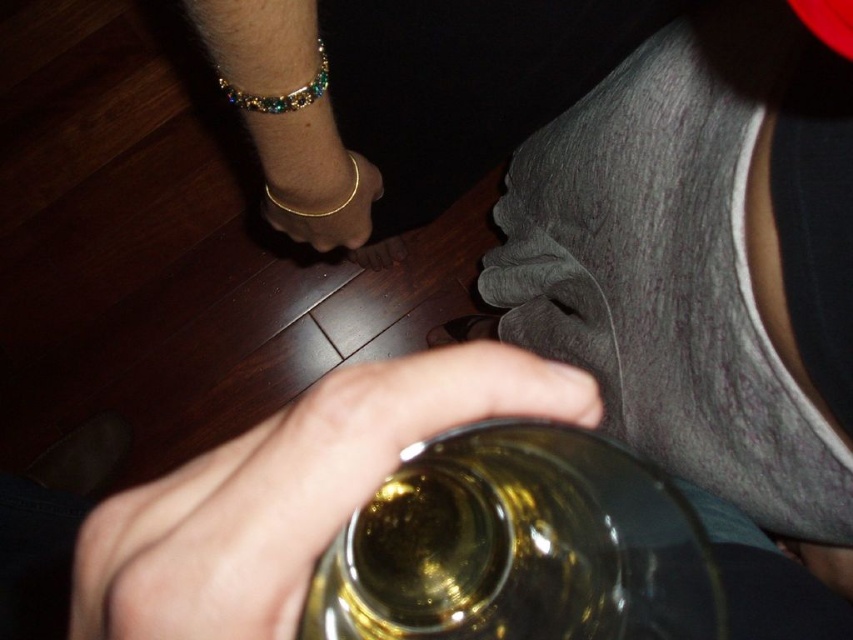
From the picture: You are at a bar and want to place your gold metallic bracelet at center on the edge of the translucent glass at lower center without it falling off. Based on the scene description, will the bracelet fit on the edge of the glass?

The translucent glass at lower center is wider than the gold metallic bracelet at center, so the bracelet will fit on the edge of the glass without falling off.

You are standing in a room and see two points marked on a wall. The first point is at coordinates point (689, 534) and the second point is at point (78, 534). Which point is closer to you?

Point (689, 534) is closer to you because it is further to the viewer than point (78, 534).

You are a bartender preparing a drink. You have a translucent glass bottle at lower center and a multicolored gemstone bracelet at upper left. Which object is located to the right of the other?

The translucent glass bottle at lower center is positioned on the right side of multicolored gemstone bracelet at upper left.